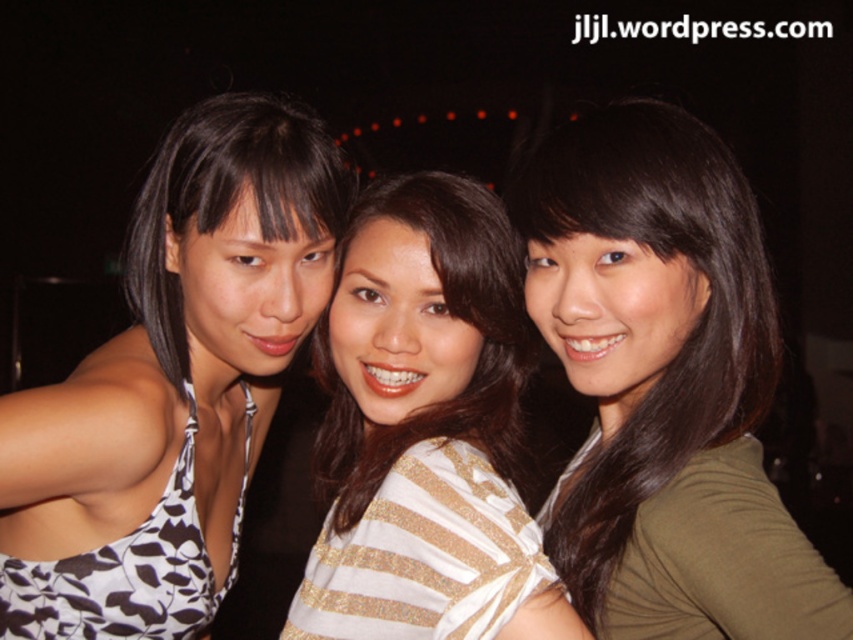
Question: Among these objects, which one is farthest from the camera?

Choices:
 (A) matte olive green shirt at center
 (B) striped fabric shirt at center
 (C) white printed dress at left

Answer: (B)

Question: Is matte olive green shirt at center in front of white printed dress at left?

Choices:
 (A) yes
 (B) no

Answer: (A)

Question: Which of these objects is positioned closest to the matte olive green shirt at center?

Choices:
 (A) white printed dress at left
 (B) striped fabric shirt at center

Answer: (B)

Question: Does matte olive green shirt at center have a greater width compared to white printed dress at left?

Choices:
 (A) yes
 (B) no

Answer: (B)

Question: Which object is positioned closest to the matte olive green shirt at center?

Choices:
 (A) white printed dress at left
 (B) striped fabric shirt at center

Answer: (B)

Question: Is matte olive green shirt at center positioned in front of striped fabric shirt at center?

Choices:
 (A) no
 (B) yes

Answer: (B)